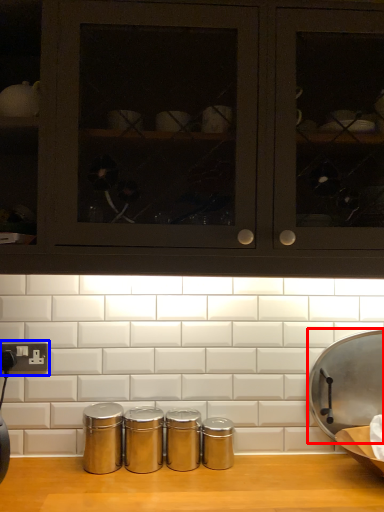
Question: Which object appears closest to the camera in this image, wide (highlighted by a red box) or electric outlet (highlighted by a blue box)?

Choices:
 (A) wide
 (B) electric outlet

Answer: (A)